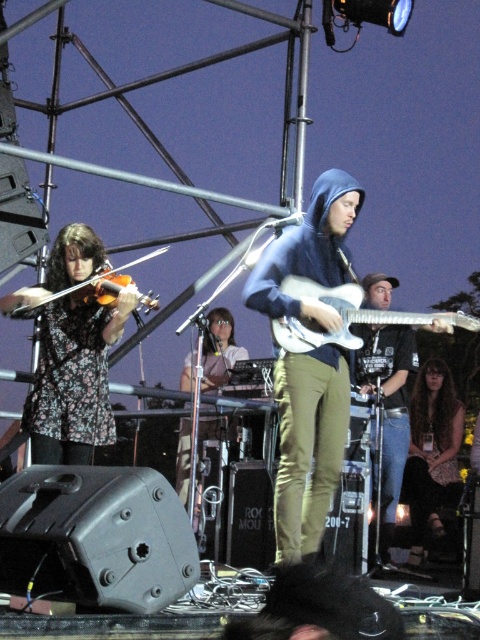
Between point (336, 337) and point (96, 273), which one is positioned behind?

The point (96, 273) is more distant.

In order to click on white glossy electric guitar at center in this screenshot , I will do `click(347, 316)`.

Locate an element on the screen. This screenshot has width=480, height=640. white glossy electric guitar at center is located at coordinates (347, 316).

Who is positioned more to the right, brown hair at center or wooden violin at left?

Positioned to the right is brown hair at center.

Is point (428, 404) positioned in front of point (116, 289)?

No, it is behind (116, 289).

Where is `brown hair at center`? brown hair at center is located at coordinates (432, 454).

Is brown hair at center bigger than white glossy electric guitar at center?

Indeed, brown hair at center has a larger size compared to white glossy electric guitar at center.

Does brown hair at center appear on the left side of white glossy electric guitar at center?

In fact, brown hair at center is to the right of white glossy electric guitar at center.

Between point (427, 392) and point (284, 289), which one is positioned behind?

The point (427, 392) is behind.

The height and width of the screenshot is (640, 480). What are the coordinates of `brown hair at center` in the screenshot? It's located at (432, 454).